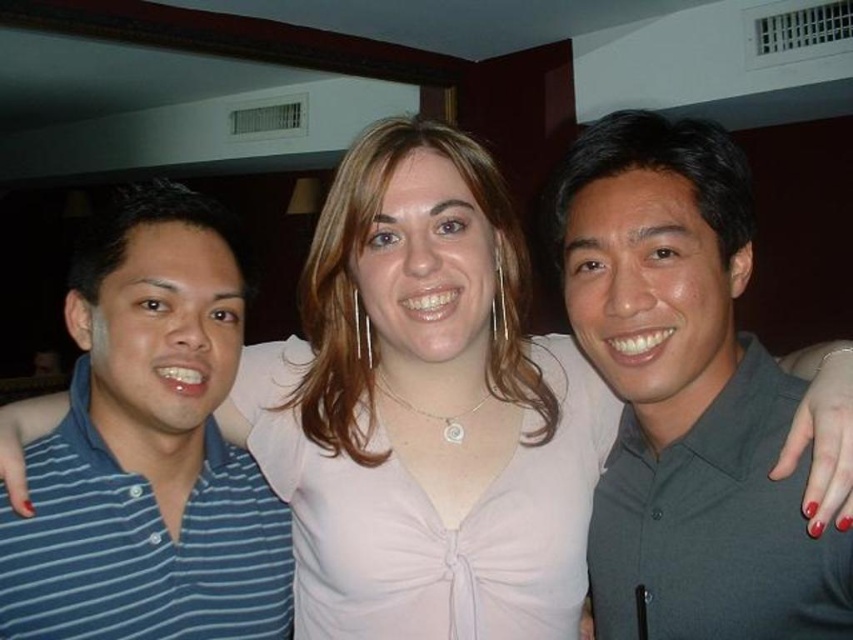
Is gray matte shirt at center in front of blue striped polo shirt at left?

Yes, it is.

Which is in front, point (572, 173) or point (218, 374)?

Point (572, 173) is in front.

The width and height of the screenshot is (853, 640). Identify the location of gray matte shirt at center. (686, 396).